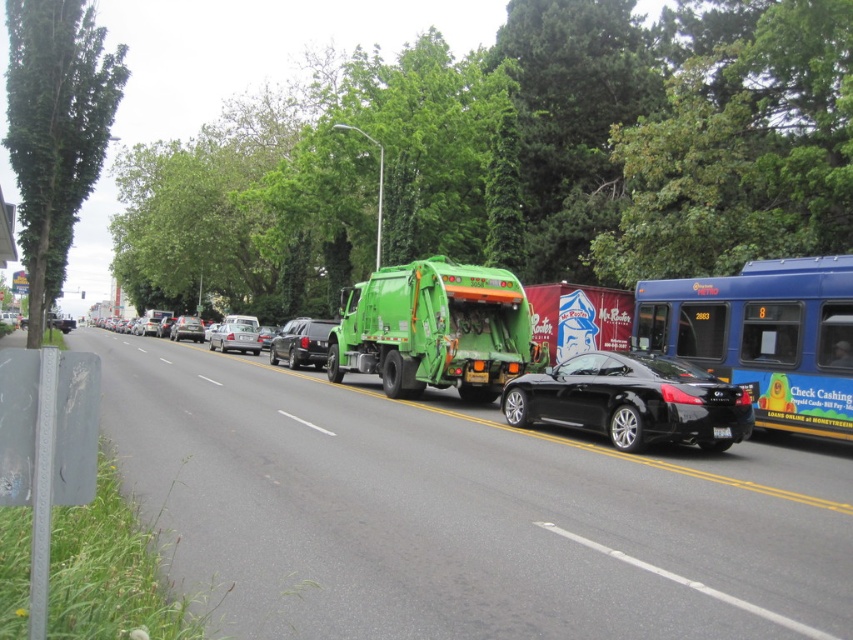
Question: Based on their relative distances, which object is nearer to the shiny silver sedan at center?

Choices:
 (A) blue metallic bus at right
 (B) green rubber garbage truck at center

Answer: (B)

Question: Which of the following is the farthest from the observer?

Choices:
 (A) (846, 324)
 (B) (198, 340)
 (C) (242, 332)
 (D) (715, 435)

Answer: (B)

Question: Does green rubber garbage truck at center have a lesser width compared to glossy black car at center?

Choices:
 (A) yes
 (B) no

Answer: (B)

Question: Is glossy black car at center below shiny silver sedan at center?

Choices:
 (A) yes
 (B) no

Answer: (A)

Question: Is shiny black suv at center smaller than satin silver sedan at center?

Choices:
 (A) yes
 (B) no

Answer: (B)

Question: Which object appears closest to the camera in this image?

Choices:
 (A) blue metallic bus at right
 (B) shiny black suv at center

Answer: (A)